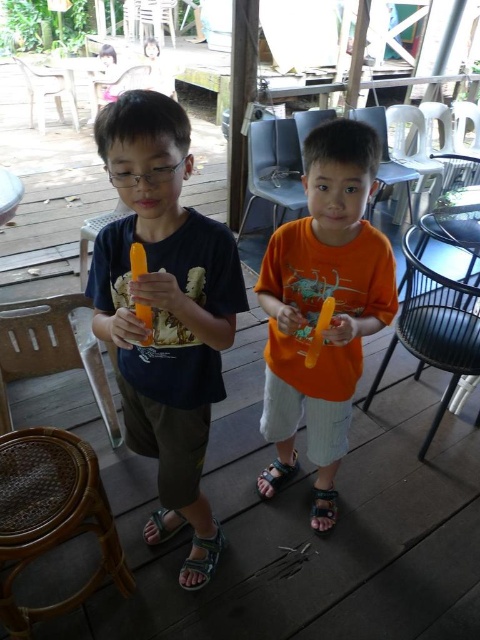
Is point (324, 496) more distant than point (282, 472)?

No, (324, 496) is in front of (282, 472).

Which is in front, point (330, 499) or point (286, 465)?

Positioned in front is point (330, 499).

Where is `brown leather sandal at lower center`? brown leather sandal at lower center is located at coordinates (324, 509).

Is point (211, 352) in front of point (156, 538)?

Yes, point (211, 352) is in front of point (156, 538).

Is matte black shirt at left smaller than black leather sandal at lower center?

No, matte black shirt at left is not smaller than black leather sandal at lower center.

This screenshot has height=640, width=480. What are the coordinates of `matte black shirt at left` in the screenshot? It's located at (164, 296).

Locate an element on the screen. matte black shirt at left is located at coordinates (164, 296).

Does black leather sandal at lower center have a greater height compared to dark blue leather sandal at lower center?

In fact, black leather sandal at lower center may be shorter than dark blue leather sandal at lower center.

Does black leather sandal at lower center lie behind dark blue leather sandal at lower center?

No, it is in front of dark blue leather sandal at lower center.

Find the location of a particular element. The height and width of the screenshot is (640, 480). black leather sandal at lower center is located at coordinates (163, 525).